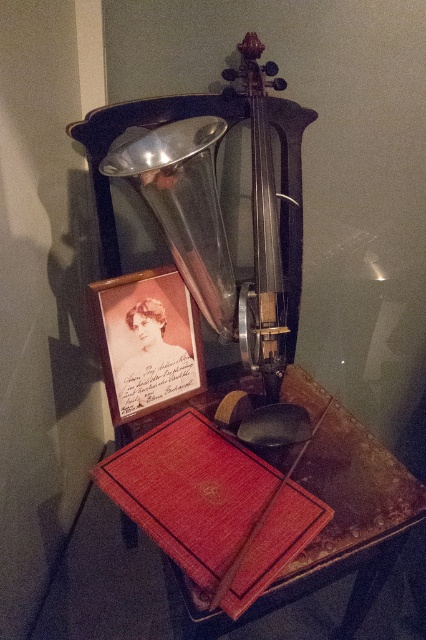
Question: Can you confirm if red leather book at lower center is positioned to the right of dark brown polished wood violin at center?

Choices:
 (A) no
 (B) yes

Answer: (B)

Question: Which object is closer to the camera taking this photo?

Choices:
 (A) matte cardboard photo frame at center-left
 (B) red leather book at center
 (C) red leather book at lower center
 (D) dark brown polished wood violin at center

Answer: (B)

Question: Which is nearer to the dark brown polished wood violin at center?

Choices:
 (A) red leather book at center
 (B) matte cardboard photo frame at center-left
 (C) red leather book at lower center

Answer: (B)

Question: Which point is farther from the camera taking this photo?

Choices:
 (A) (345, 444)
 (B) (129, 500)
 (C) (106, 326)

Answer: (A)

Question: Does red leather book at center have a greater width compared to matte cardboard photo frame at center-left?

Choices:
 (A) no
 (B) yes

Answer: (B)

Question: Where is red leather book at lower center located in relation to matte cardboard photo frame at center-left in the image?

Choices:
 (A) right
 (B) left

Answer: (A)